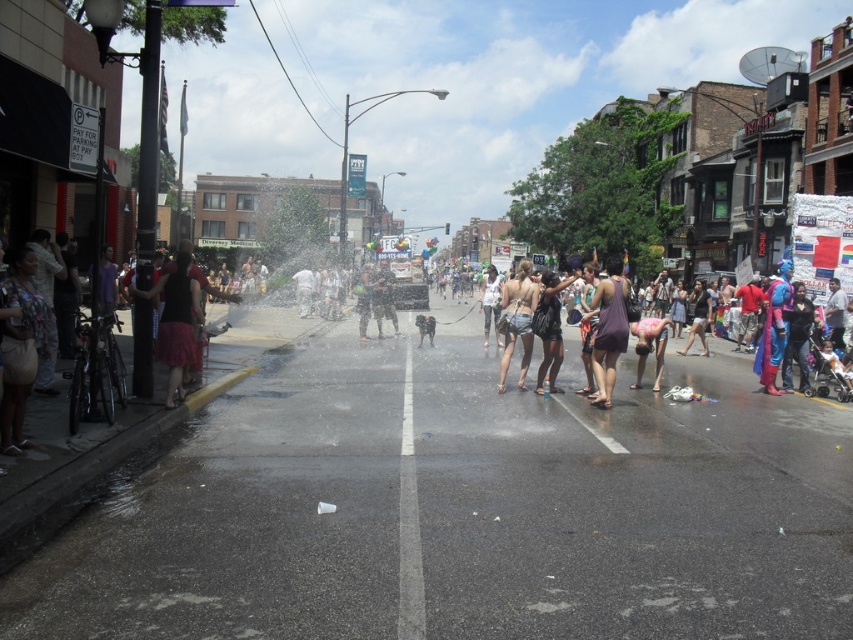
Is matte purple dress at center taller than white cotton tank top at center?

No.

Which is in front, point (606, 369) or point (485, 337)?

Positioned in front is point (606, 369).

What are the coordinates of `matte purple dress at center` in the screenshot? It's located at point(608,333).

Identify the location of matte purple dress at center. (608, 333).

Can you confirm if shiny blue costume at center right is positioned above matte purple tank top at center?

Actually, shiny blue costume at center right is below matte purple tank top at center.

Does shiny blue costume at center right have a larger size compared to matte purple tank top at center?

Incorrect, shiny blue costume at center right is not larger than matte purple tank top at center.

Measure the distance between point (784, 362) and camera.

A distance of 38.83 feet exists between point (784, 362) and camera.

The image size is (853, 640). Find the location of `shiny blue costume at center right`. shiny blue costume at center right is located at coordinates (798, 339).

Between shiny metallic costume at right and dark purple tank top at center, which one has more height?

shiny metallic costume at right is taller.

From the picture: Is shiny metallic costume at right thinner than dark purple tank top at center?

In fact, shiny metallic costume at right might be wider than dark purple tank top at center.

Between point (779, 321) and point (560, 336), which one is positioned in front?

Point (560, 336) is in front.

The image size is (853, 640). Find the location of `shiny metallic costume at right`. shiny metallic costume at right is located at coordinates (775, 326).